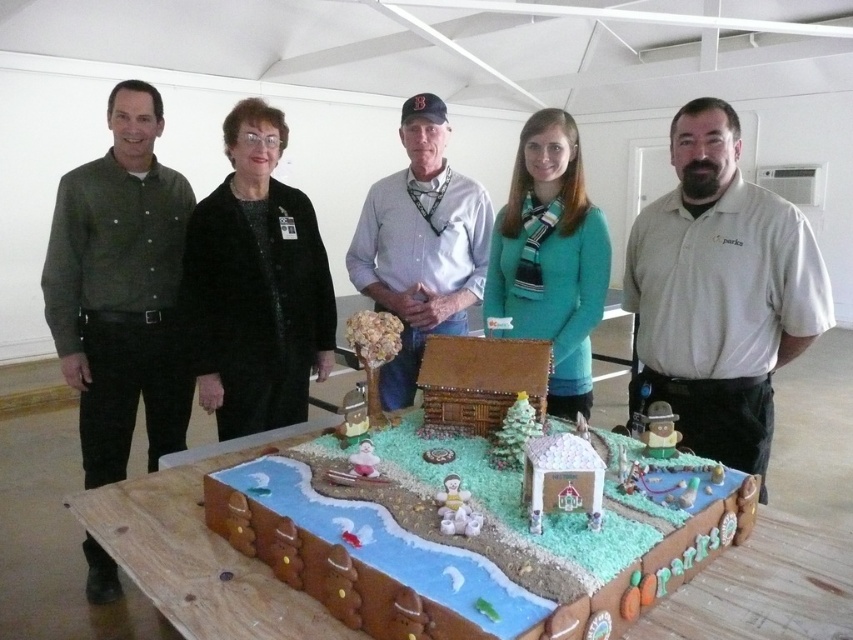
You are organizing a photo shoot for a clothing catalog and need to determine which of the two models wearing the gray cotton shirt at center and the teal matte sweater at center will have their outfits better displayed. Considering the size of their clothing items, which model should be positioned closer to the camera to emphasize the details?

The gray cotton shirt at center is bigger than the teal matte sweater at center, so the model wearing the gray cotton shirt at center should be positioned closer to the camera to better showcase its details.

You are a photographer trying to capture a clear shot of both the black fuzzy coat at center and the teal matte sweater at center. Since you want to ensure both are visible in the frame, which clothing item should you focus on first to account for their size difference?

The black fuzzy coat at center is taller than the teal matte sweater at center, so you should focus on the black fuzzy coat at center first to ensure its full height is captured before adjusting the frame for the shorter teal matte sweater at center.